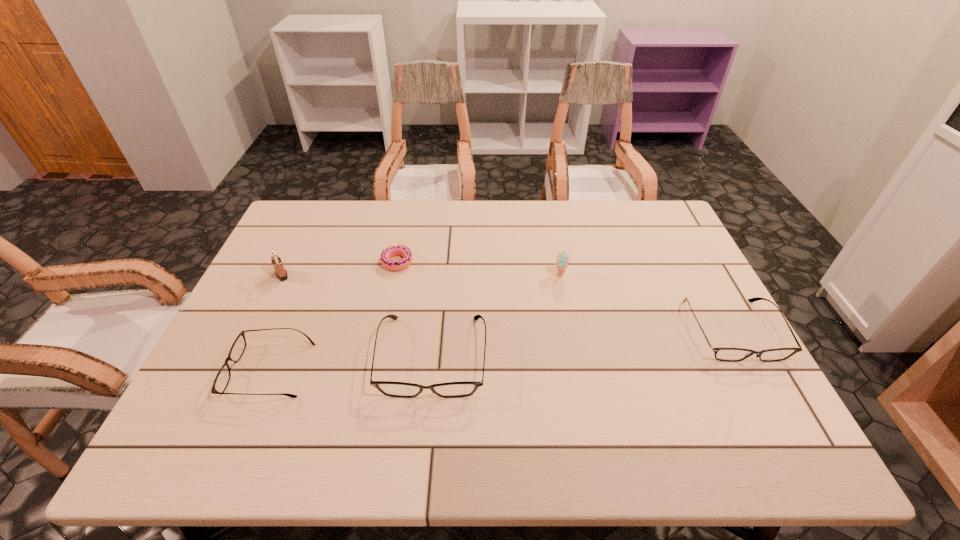
Where is `object that stands as the third closest to the fifth object from left to right`? This screenshot has width=960, height=540. object that stands as the third closest to the fifth object from left to right is located at coordinates (399, 250).

Select which object appears as the fifth closest to the shortest object. Please provide its 2D coordinates. Your answer should be formatted as a tuple, i.e. [(x, y)], where the tuple contains the x and y coordinates of a point satisfying the conditions above.

[(726, 354)]

Choose which spectacles is the nearest neighbor to the leftmost spectacles. Please provide its 2D coordinates. Your answer should be formatted as a tuple, i.e. [(x, y)], where the tuple contains the x and y coordinates of a point satisfying the conditions above.

[(389, 388)]

Identify which spectacles is located as the second nearest to the padlock. Please provide its 2D coordinates. Your answer should be formatted as a tuple, i.e. [(x, y)], where the tuple contains the x and y coordinates of a point satisfying the conditions above.

[(389, 388)]

In order to click on vacant point that satisfies the following two spatial constraints: 1. on the front side of the shortest object; 2. on the front-facing side of the second shortest object in this screenshot , I will do `click(375, 370)`.

I want to click on vacant space that satisfies the following two spatial constraints: 1. on the front-facing side of the second spectacles from left to right; 2. on the front-facing side of the shortest spectacles, so click(431, 370).

Where is `vacant area that satisfies the following two spatial constraints: 1. on the back side of the shortest object; 2. on the right side of the padlock`? vacant area that satisfies the following two spatial constraints: 1. on the back side of the shortest object; 2. on the right side of the padlock is located at coordinates (288, 262).

Where is `vacant area that satisfies the following two spatial constraints: 1. on the front-facing side of the rightmost spectacles; 2. on the front-facing side of the shortest spectacles`? vacant area that satisfies the following two spatial constraints: 1. on the front-facing side of the rightmost spectacles; 2. on the front-facing side of the shortest spectacles is located at coordinates (754, 370).